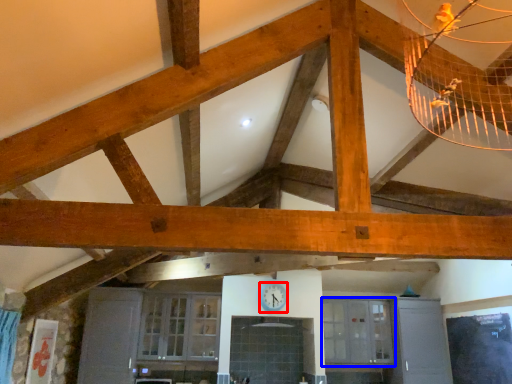
Question: Which point is closer to the camera, clock (highlighted by a red box) or window (highlighted by a blue box)?

Choices:
 (A) clock
 (B) window

Answer: (A)